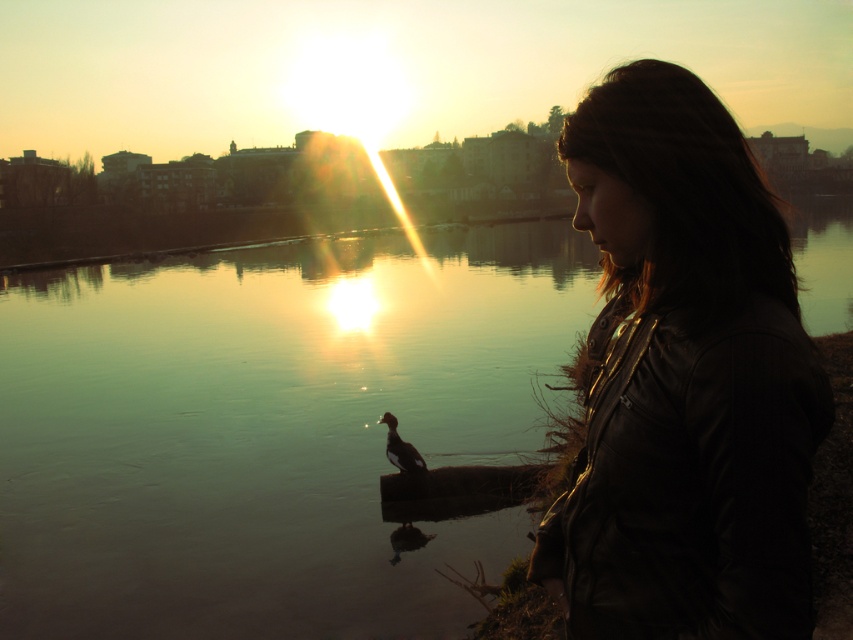
Is greenish water at center to the right of dark brown feathers at center from the viewer's perspective?

Correct, you'll find greenish water at center to the right of dark brown feathers at center.

Is point (262, 355) behind point (395, 456)?

That is True.

Does point (318, 262) come farther from viewer compared to point (422, 474)?

Yes.

At what (x,y) coordinates should I click in order to perform the action: click on greenish water at center. Please return your answer as a coordinate pair (x, y). The height and width of the screenshot is (640, 853). Looking at the image, I should click on click(268, 429).

Which of these two, greenish water at center or leather jacket at right, stands shorter?

With less height is leather jacket at right.

Does greenish water at center have a greater width compared to leather jacket at right?

Yes.

This screenshot has height=640, width=853. I want to click on greenish water at center, so click(268, 429).

Between point (740, 410) and point (398, 451), which one is positioned in front?

Point (740, 410)

Describe the element at coordinates (683, 380) in the screenshot. This screenshot has width=853, height=640. I see `leather jacket at right` at that location.

Which is behind, point (610, 164) or point (392, 426)?

Point (392, 426)

Identify the location of leather jacket at right. point(683,380).